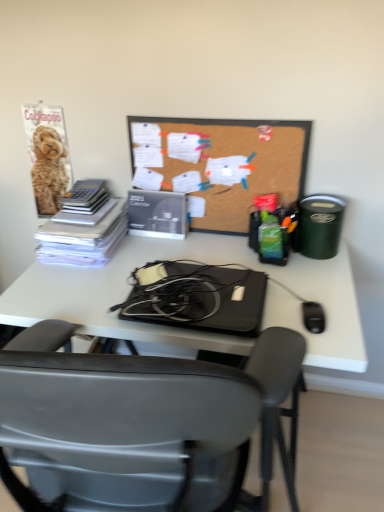
The height and width of the screenshot is (512, 384). What are the coordinates of `unoccupied region to the right of matte black calendar at center` in the screenshot? It's located at (215, 243).